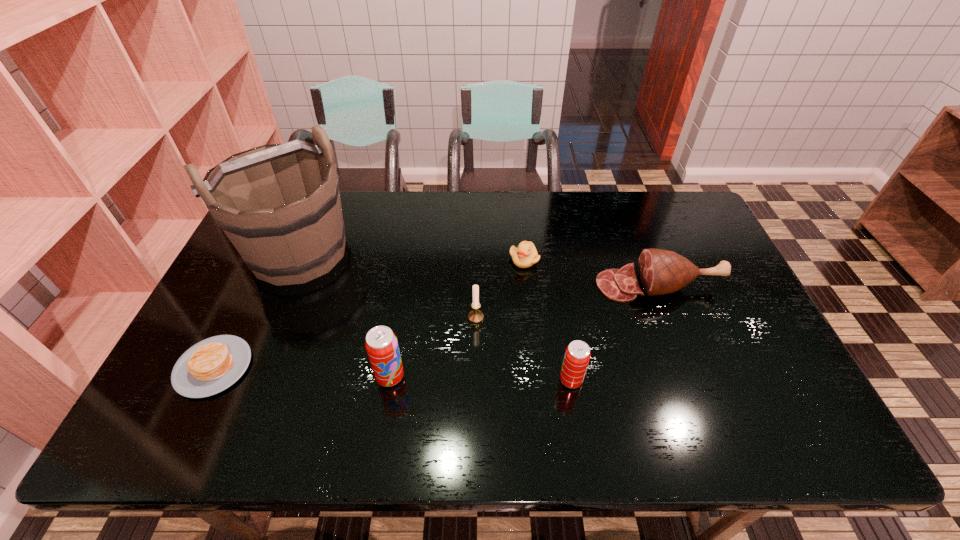
The width and height of the screenshot is (960, 540). In order to click on object that is at the far edge in this screenshot , I will do `click(279, 204)`.

Locate an element on the screen. The image size is (960, 540). pancake located at the near edge is located at coordinates (212, 365).

Identify the location of bucket that is at the left edge. (279, 204).

At what (x,y) coordinates should I click in order to perform the action: click on pancake that is at the left edge. Please return your answer as a coordinate pair (x, y). This screenshot has width=960, height=540. Looking at the image, I should click on (212, 365).

The width and height of the screenshot is (960, 540). In order to click on object located at the right edge in this screenshot , I will do `click(660, 272)`.

In order to click on object present at the far left corner in this screenshot , I will do `click(279, 204)`.

Locate an element on the screen. The width and height of the screenshot is (960, 540). object situated at the near left corner is located at coordinates (212, 365).

In the image, there is a desktop. Where is `free region at the far edge`? free region at the far edge is located at coordinates 552,194.

Image resolution: width=960 pixels, height=540 pixels. Find the location of `vacant region at the near edge of the desktop`. vacant region at the near edge of the desktop is located at coordinates (529, 373).

Where is `free region at the right edge`? The width and height of the screenshot is (960, 540). free region at the right edge is located at coordinates (692, 248).